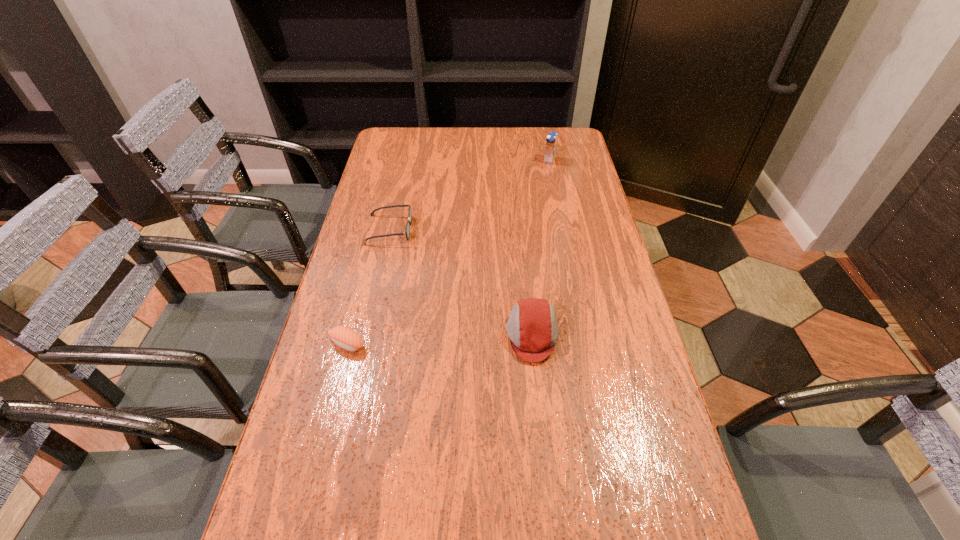
Image resolution: width=960 pixels, height=540 pixels. Find the location of `vacant area that lies between the sushi and the third object from left to right`. vacant area that lies between the sushi and the third object from left to right is located at coordinates pos(440,340).

What are the coordinates of `free space between the second tallest object and the sushi` in the screenshot? It's located at (440, 340).

In order to click on object that is the third closest one to the sushi in this screenshot , I will do `click(551, 141)`.

Find the location of `the third closest object to the spectacles`. the third closest object to the spectacles is located at coordinates (551, 141).

In order to click on vacant space that satisfies the following two spatial constraints: 1. on the front side of the rightmost object; 2. on the front-facing side of the third shortest object in this screenshot , I will do `click(585, 335)`.

Identify the location of free space that satisfies the following two spatial constraints: 1. on the front-facing side of the second object from right to left; 2. on the front side of the sushi. (533, 344).